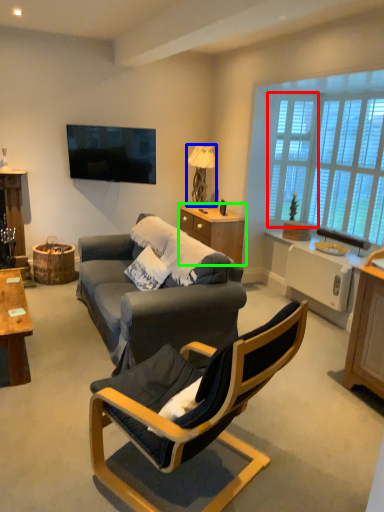
Question: Estimate the real-world distances between objects in this image. Which object is farther from window screen (highlighted by a red box), lamp (highlighted by a blue box) or dresser (highlighted by a green box)?

Choices:
 (A) lamp
 (B) dresser

Answer: (A)